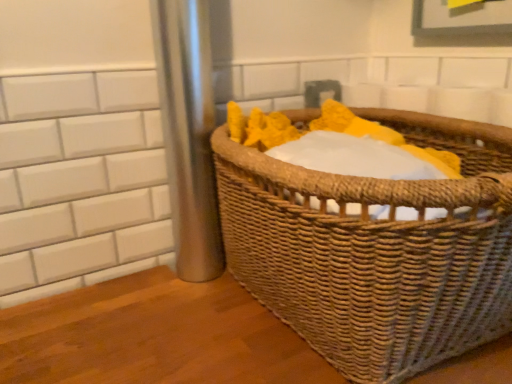
In order to face woven brown picnic basket at center, should I rotate leftwards or rightwards?

You should rotate right by 15.348 degrees.

The image size is (512, 384). Describe the element at coordinates (376, 249) in the screenshot. I see `woven brown picnic basket at center` at that location.

Find the location of a particular element. Image resolution: width=512 pixels, height=384 pixels. woven brown picnic basket at center is located at coordinates (376, 249).

What are the coordinates of `woven brown picnic basket at center` in the screenshot? It's located at (376, 249).